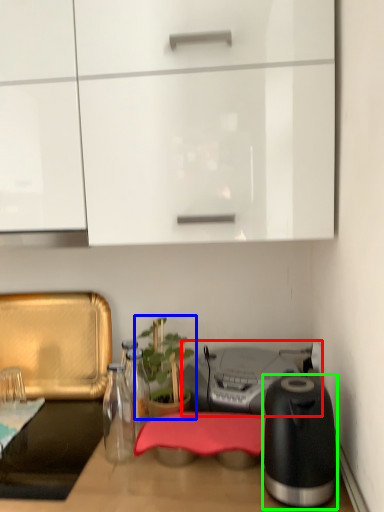
Question: Estimate the real-world distances between objects in this image. Which object is closer to appliance (highlighted by a red box), houseplant (highlighted by a blue box) or kitchen appliance (highlighted by a green box)?

Choices:
 (A) houseplant
 (B) kitchen appliance

Answer: (A)